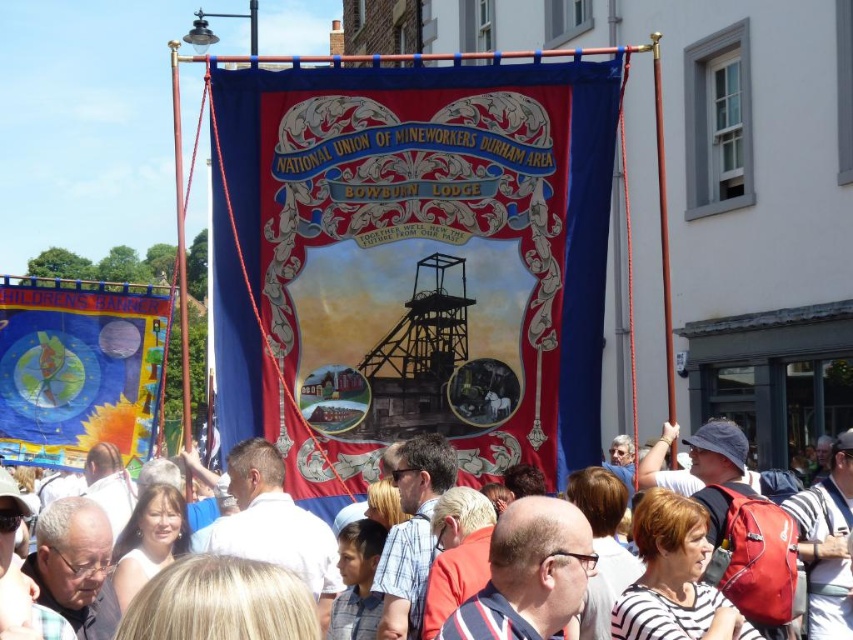
Does silk banner at center appear on the left side of blue fabric banner at left?

In fact, silk banner at center is to the right of blue fabric banner at left.

Between point (419, 109) and point (148, 445), which one is positioned in front?

Point (419, 109) is in front.

The width and height of the screenshot is (853, 640). Find the location of `silk banner at center`. silk banner at center is located at coordinates (410, 262).

Does blue fabric banner at left appear on the left side of white cotton shirt at center?

Yes, blue fabric banner at left is to the left of white cotton shirt at center.

Looking at this image, does blue fabric banner at left have a lesser width compared to white cotton shirt at center?

Yes, blue fabric banner at left is thinner than white cotton shirt at center.

Is point (62, 317) farther from viewer compared to point (778, 621)?

Yes, it is behind point (778, 621).

This screenshot has height=640, width=853. I want to click on blue fabric banner at left, so click(x=79, y=369).

Is the position of silk banner at center more distant than that of white cotton shirt at center?

Yes.

Who is lower down, silk banner at center or white cotton shirt at center?

white cotton shirt at center is below.

Which is behind, point (318, 426) or point (849, 600)?

Positioned behind is point (318, 426).

What are the coordinates of `silk banner at center` in the screenshot? It's located at (410, 262).